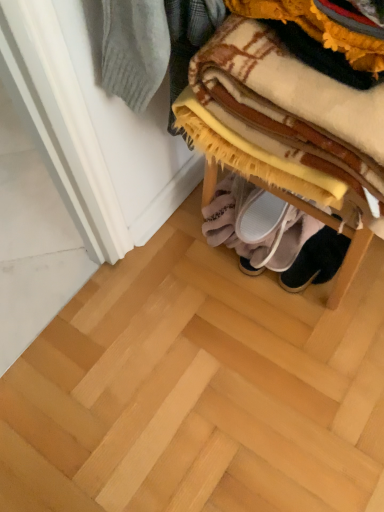
Locate an element on the screen. The width and height of the screenshot is (384, 512). vacant region in front of black suede shoes at lower center, which ranks as the first footwear in right-to-left order is located at coordinates (329, 323).